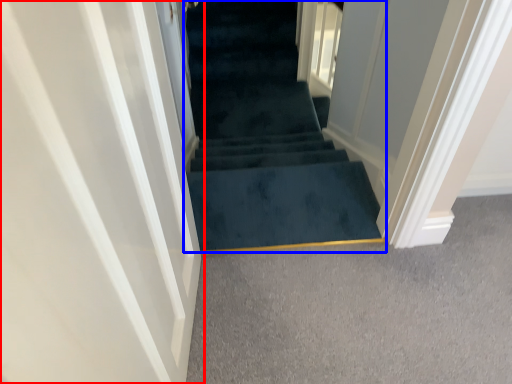
Question: Which point is further to the camera, door (highlighted by a red box) or stairs (highlighted by a blue box)?

Choices:
 (A) door
 (B) stairs

Answer: (B)